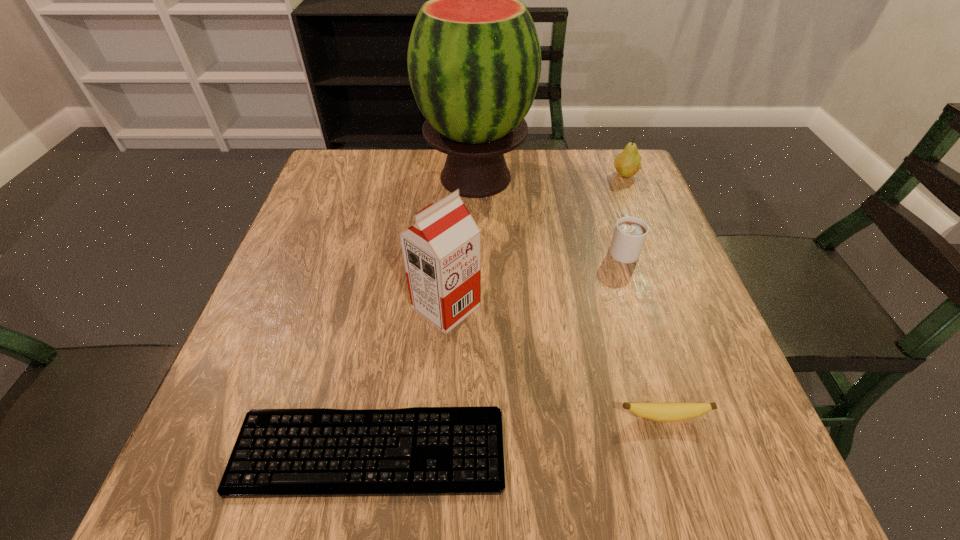
The height and width of the screenshot is (540, 960). In order to click on the tallest object in this screenshot , I will do [474, 59].

The width and height of the screenshot is (960, 540). I want to click on the second tallest object, so click(x=442, y=251).

Find the location of a particular element. the fourth farthest object is located at coordinates point(442,251).

You are a GUI agent. You are given a task and a screenshot of the screen. Output one action in this format:
    pyautogui.click(x=<x>, y=<y>)
    Task: Click on the pear
    
    Given the screenshot: What is the action you would take?
    pyautogui.click(x=628, y=163)

Identify the location of the fourth tallest object. (630, 233).

Find the location of a particular element. The image size is (960, 540). cappuccino is located at coordinates (630, 233).

You are a GUI agent. You are given a task and a screenshot of the screen. Output one action in this format:
    pyautogui.click(x=<x>, y=<y>)
    Task: Click on the fifth tallest object
    This screenshot has height=540, width=960.
    Given the screenshot: What is the action you would take?
    pyautogui.click(x=661, y=412)

Find the location of `computer keyboard`. computer keyboard is located at coordinates (422, 451).

At what (x,y) coordinates should I click in order to perform the action: click on vacant space situated 0.110m on the left of the watermelon. Please return your answer as a coordinate pair (x, y). The image size is (960, 540). Looking at the image, I should click on (380, 178).

Where is `free space located on the back of the soya milk`? free space located on the back of the soya milk is located at coordinates (453, 202).